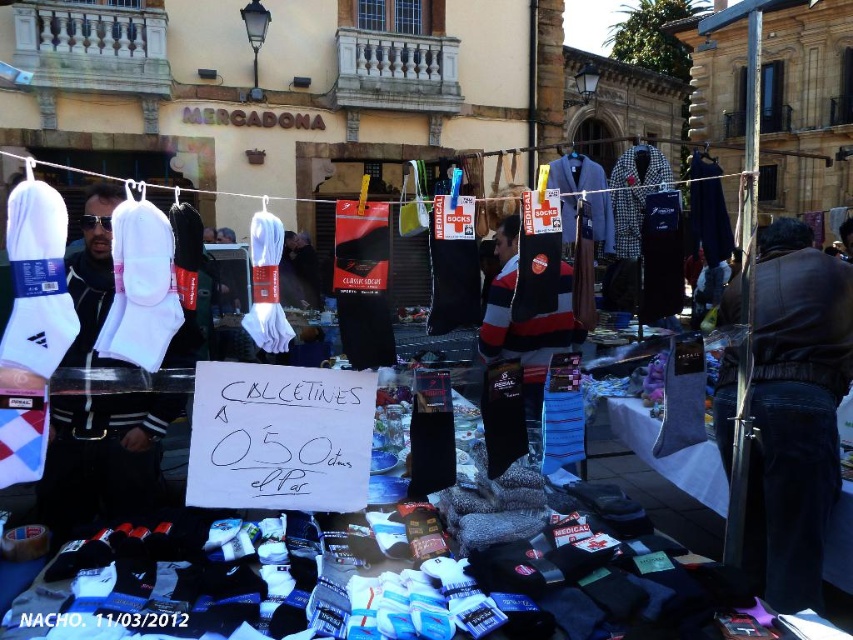
Question: Which point appears farthest from the camera in this image?

Choices:
 (A) [x=96, y=486]
 (B) [x=833, y=468]

Answer: (A)

Question: Does dark brown leather jacket at right appear on the left side of white matte socks at left?

Choices:
 (A) yes
 (B) no

Answer: (B)

Question: Can you confirm if dark brown leather jacket at right is thinner than white matte socks at left?

Choices:
 (A) no
 (B) yes

Answer: (B)

Question: Does dark brown leather jacket at right come behind white matte socks at left?

Choices:
 (A) yes
 (B) no

Answer: (A)

Question: Which point is farther to the camera?

Choices:
 (A) dark brown leather jacket at right
 (B) white matte socks at left

Answer: (A)

Question: Which point is farther to the camera?

Choices:
 (A) dark brown leather jacket at right
 (B) white matte socks at left

Answer: (A)